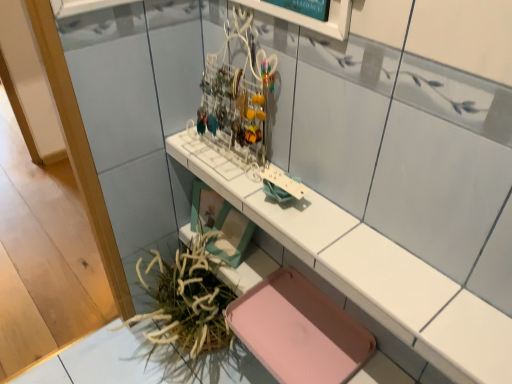
Question: Considering their positions, is pink matte tray at lower center located in front of or behind white glossy counter at center?

Choices:
 (A) front
 (B) behind

Answer: (B)

Question: Considering the positions of pink matte tray at lower center and white glossy counter at center in the image, is pink matte tray at lower center wider or thinner than white glossy counter at center?

Choices:
 (A) wide
 (B) thin

Answer: (A)

Question: Considering the real-world distances, which object is closest to the white glossy counter at center?

Choices:
 (A) pink matte tray at lower center
 (B) green leafy plant at lower left

Answer: (A)

Question: Which object is positioned farthest from the green leafy plant at lower left?

Choices:
 (A) pink matte tray at lower center
 (B) white glossy counter at center

Answer: (B)